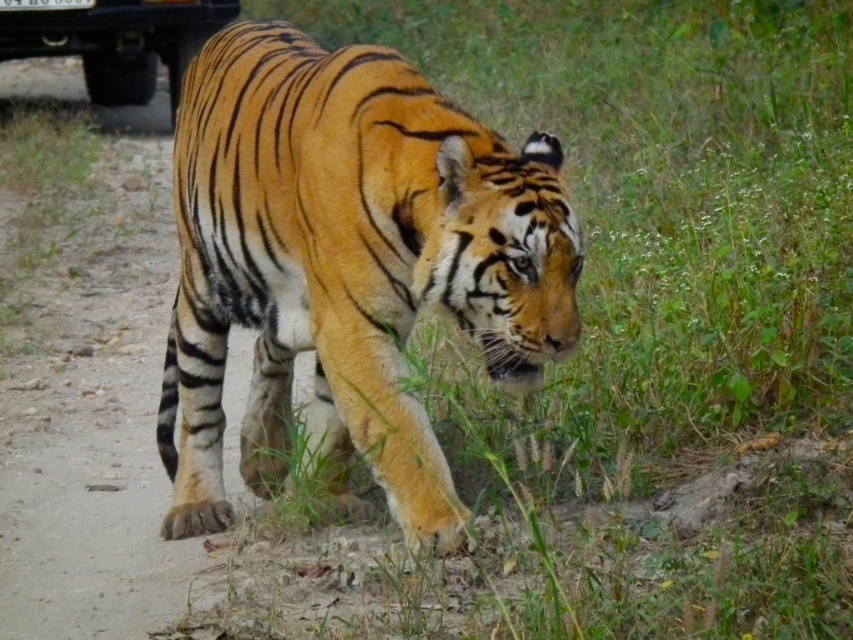
You are a wildlife photographer standing 3 meters away from a dirt path where the orange striped tiger at center is walking. You want to capture a close shot without disturbing the tiger. Can you safely take the photo from your current position?

The orange striped tiger at center is 2.86 meters away from viewer. Since you are standing 3 meters away from the dirt path, you can safely take the photo from your current position as the distance is sufficient to avoid disturbing the tiger.

You are a wildlife photographer trying to capture a photo of the orange striped tiger at center. The metallic black truck at upper left is blocking part of your view. Can you estimate if the tiger is taller than the truck to decide whether to adjust your camera angle upwards or downwards?

The orange striped tiger at center is much taller than the metallic black truck at upper left, so you should adjust your camera angle upwards to capture the tiger properly.